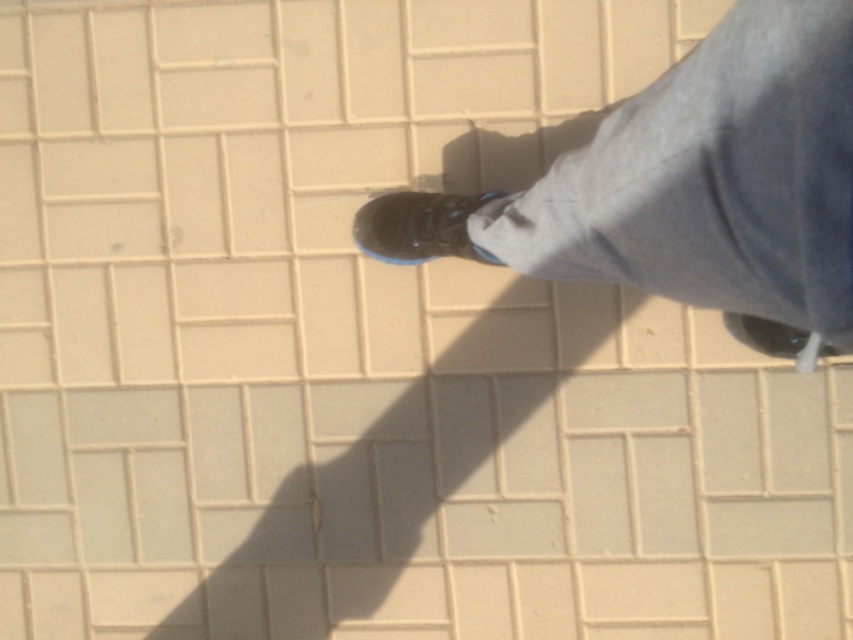
Question: Which object appears closest to the camera in this image?

Choices:
 (A) black rubber shoe at center
 (B) matte black shoe at lower right
 (C) shiny black shoe at center

Answer: (A)

Question: Which object is farther from the camera taking this photo?

Choices:
 (A) matte black shoe at lower right
 (B) shiny black shoe at center

Answer: (B)

Question: Does shiny black shoe at center appear on the right side of matte black shoe at lower right?

Choices:
 (A) no
 (B) yes

Answer: (A)

Question: Estimate the real-world distances between objects in this image. Which object is farther from the matte black shoe at lower right?

Choices:
 (A) shiny black shoe at center
 (B) black rubber shoe at center

Answer: (B)

Question: Is black rubber shoe at center closer to the viewer compared to matte black shoe at lower right?

Choices:
 (A) no
 (B) yes

Answer: (B)

Question: Is black rubber shoe at center positioned at the back of matte black shoe at lower right?

Choices:
 (A) yes
 (B) no

Answer: (B)